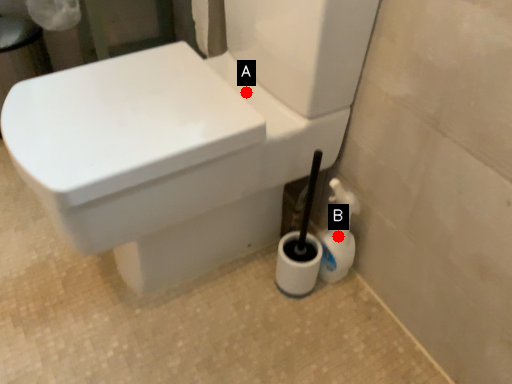
Question: Two points are circled on the image, labeled by A and B beside each circle. Among these points, which one is nearest to the camera?

Choices:
 (A) A is closer
 (B) B is closer

Answer: (A)